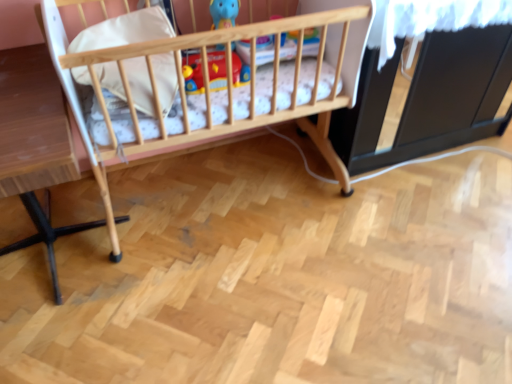
The image size is (512, 384). What are the coordinates of `vacant area that lies to the right of light brown wooden table at left` in the screenshot? It's located at (197, 291).